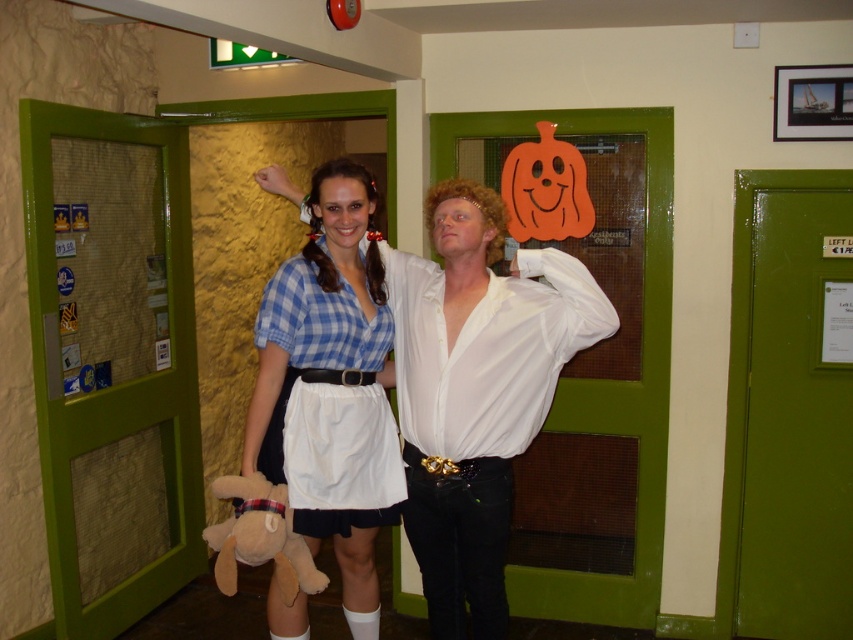
Who is more forward, (555, 317) or (250, 412)?

Positioned in front is point (250, 412).

Which is more to the right, matte blue plaid shirt at center or blue checkered shirt at center?

Positioned to the right is matte blue plaid shirt at center.

You are a GUI agent. You are given a task and a screenshot of the screen. Output one action in this format:
    pyautogui.click(x=<x>, y=<y>)
    Task: Click on the matte blue plaid shirt at center
    
    Given the screenshot: What is the action you would take?
    pyautogui.click(x=476, y=390)

You are a GUI agent. You are given a task and a screenshot of the screen. Output one action in this format:
    pyautogui.click(x=<x>, y=<y>)
    Task: Click on the matte blue plaid shirt at center
    This screenshot has width=853, height=640.
    Given the screenshot: What is the action you would take?
    pyautogui.click(x=476, y=390)